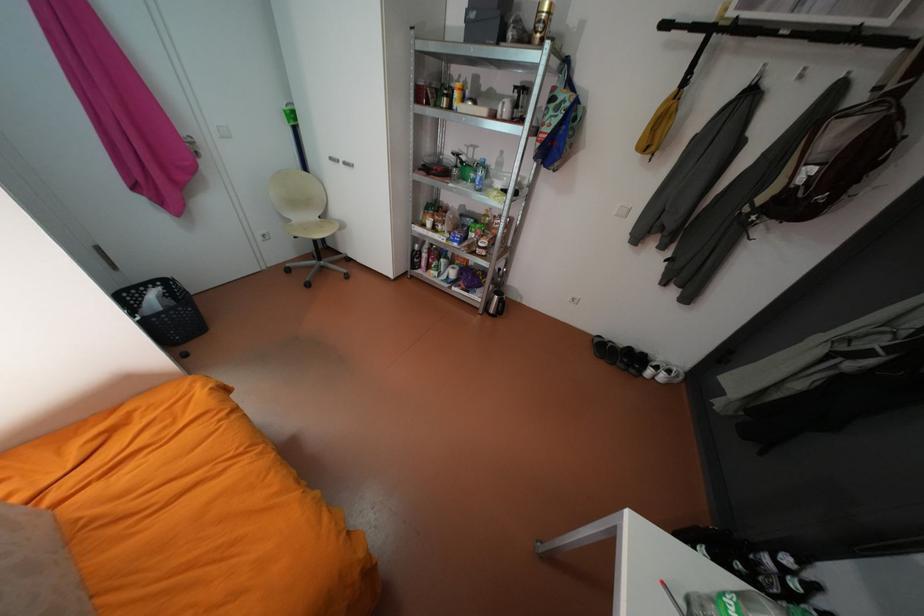
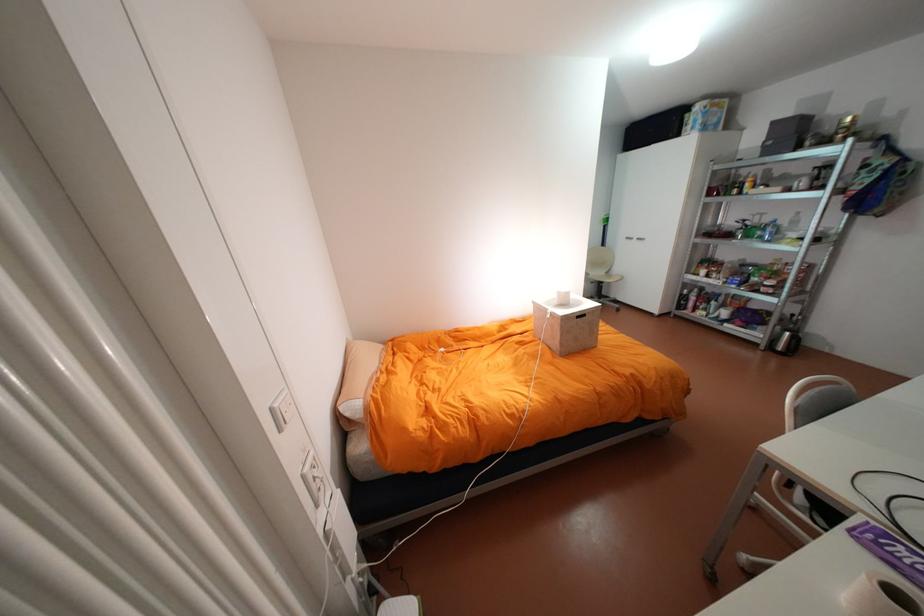
Locate, in the second image, the point that corresponds to point (341, 158) in the first image.

(636, 237)